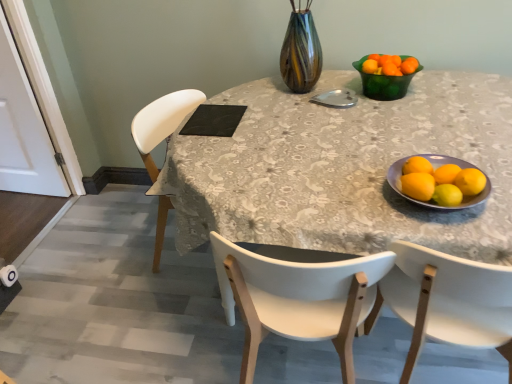
Identify the location of free space above black matte placemat at upper center (from a real-world perspective). (216, 112).